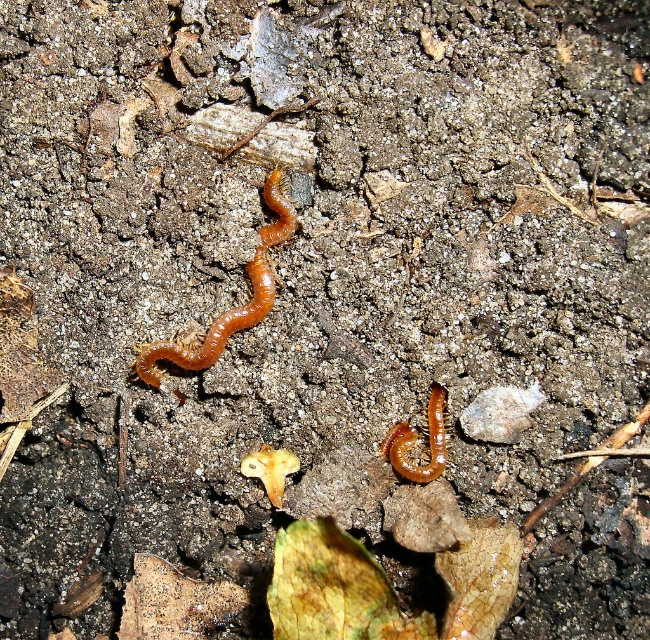
The width and height of the screenshot is (650, 640). Identify the location of shiny orange centipede at center. (231, 308).